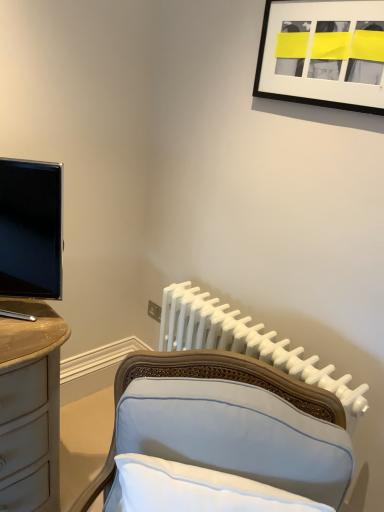
Question: Can you confirm if black matte picture frame at upper right is positioned to the right of matte black tv at left?

Choices:
 (A) no
 (B) yes

Answer: (B)

Question: Is black matte picture frame at upper right touching matte black tv at left?

Choices:
 (A) no
 (B) yes

Answer: (A)

Question: From a real-world perspective, does black matte picture frame at upper right stand above matte black tv at left?

Choices:
 (A) no
 (B) yes

Answer: (B)

Question: Is the position of black matte picture frame at upper right more distant than that of matte black tv at left?

Choices:
 (A) no
 (B) yes

Answer: (B)

Question: From the image's perspective, is black matte picture frame at upper right under matte black tv at left?

Choices:
 (A) no
 (B) yes

Answer: (A)

Question: From the image's perspective, is white plastic radiator at center above or below light blue fabric chair at lower center?

Choices:
 (A) above
 (B) below

Answer: (A)

Question: Looking at the image, does white plastic radiator at center seem bigger or smaller compared to light blue fabric chair at lower center?

Choices:
 (A) small
 (B) big

Answer: (B)

Question: Considering the positions of point (332, 365) and point (339, 418), is point (332, 365) closer or farther from the camera than point (339, 418)?

Choices:
 (A) farther
 (B) closer

Answer: (A)

Question: Relative to light blue fabric chair at lower center, is white plastic radiator at center in front or behind?

Choices:
 (A) front
 (B) behind

Answer: (B)

Question: Looking at the image, does white plastic radiator at center seem bigger or smaller compared to black matte picture frame at upper right?

Choices:
 (A) big
 (B) small

Answer: (A)

Question: Is point (319, 379) closer or farther from the camera than point (299, 54)?

Choices:
 (A) farther
 (B) closer

Answer: (B)

Question: Choose the correct answer: Is white plastic radiator at center inside black matte picture frame at upper right or outside it?

Choices:
 (A) outside
 (B) inside

Answer: (A)

Question: From their relative heights in the image, would you say white plastic radiator at center is taller or shorter than black matte picture frame at upper right?

Choices:
 (A) tall
 (B) short

Answer: (A)

Question: From the image's perspective, relative to white plastic radiator at center, is light blue fabric chair at lower center above or below?

Choices:
 (A) below
 (B) above

Answer: (A)

Question: Which is correct: light blue fabric chair at lower center is inside white plastic radiator at center, or outside of it?

Choices:
 (A) outside
 (B) inside

Answer: (A)